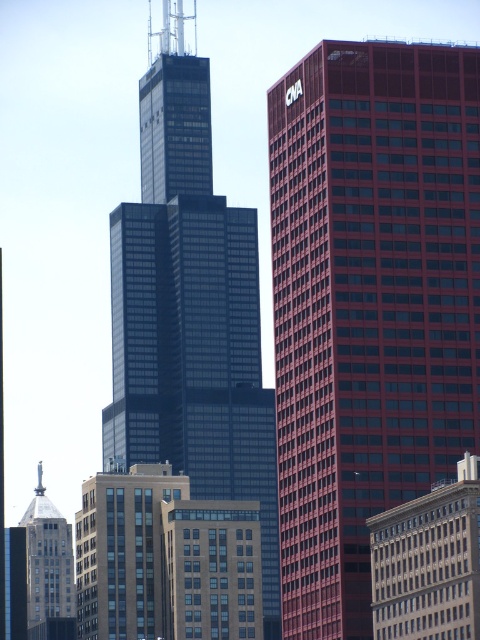
Between point (249, 330) and point (71, 604), which one is positioned in front?

Point (249, 330)

Does dark glass skyscraper at center have a smaller size compared to silver metallic statue at upper left?

No.

What do you see at coordinates (190, 314) in the screenshot?
I see `dark glass skyscraper at center` at bounding box center [190, 314].

Where is `dark glass skyscraper at center`? The height and width of the screenshot is (640, 480). dark glass skyscraper at center is located at coordinates (190, 314).

Between smooth glass building at right and brick building at lower right, which one appears on the left side from the viewer's perspective?

Positioned to the left is smooth glass building at right.

Is point (347, 282) farther from viewer compared to point (418, 632)?

Yes, it is.

Find the location of a particular element. smooth glass building at right is located at coordinates 369,304.

Does dark glass skyscraper at center appear over brick building at lower right?

Indeed, dark glass skyscraper at center is positioned over brick building at lower right.

Who is more distant from viewer, (223, 232) or (408, 572)?

Positioned behind is point (223, 232).

At what (x,y) coordinates should I click in order to perform the action: click on dark glass skyscraper at center. Please return your answer as a coordinate pair (x, y). Looking at the image, I should click on (190, 314).